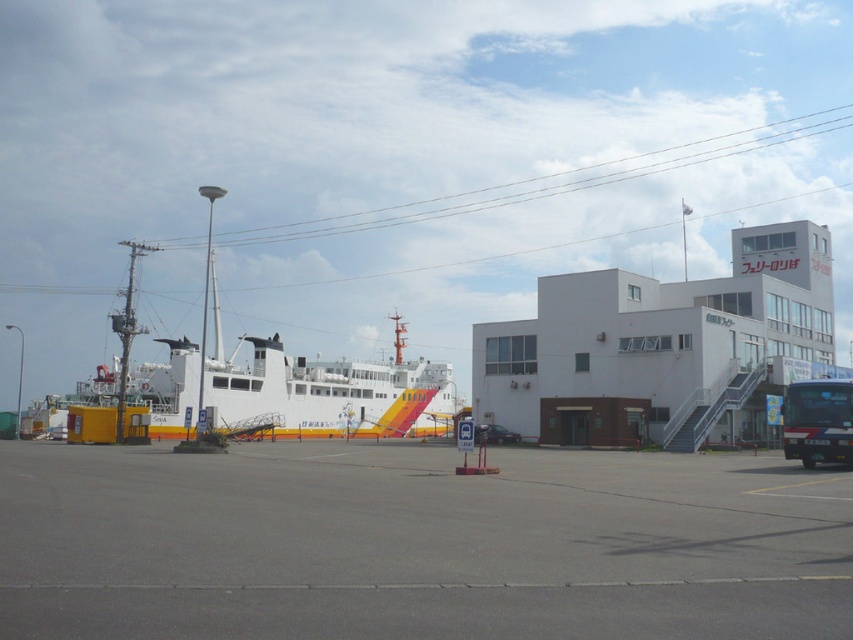
Question: Does gray asphalt parking lot at center have a smaller size compared to shiny black car at center?

Choices:
 (A) no
 (B) yes

Answer: (A)

Question: Can you confirm if green matte bus at lower right is thinner than shiny black car at center?

Choices:
 (A) no
 (B) yes

Answer: (A)

Question: Which object is the closest to the green matte bus at lower right?

Choices:
 (A) gray asphalt parking lot at center
 (B) shiny black car at center

Answer: (B)

Question: Which of the following is the closest to the observer?

Choices:
 (A) gray asphalt parking lot at center
 (B) green matte bus at lower right

Answer: (A)

Question: From the image, what is the correct spatial relationship of green matte bus at lower right in relation to shiny black car at center?

Choices:
 (A) left
 (B) right

Answer: (B)

Question: Which object is farther from the camera taking this photo?

Choices:
 (A) green matte bus at lower right
 (B) gray asphalt parking lot at center

Answer: (A)